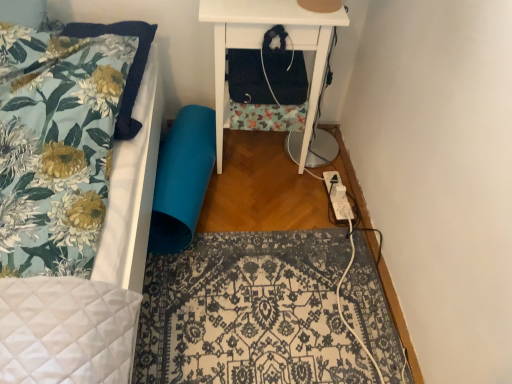
Find the location of a particular element. The image size is (512, 384). vacant space to the left of white plastic extension cord at lower right is located at coordinates (298, 198).